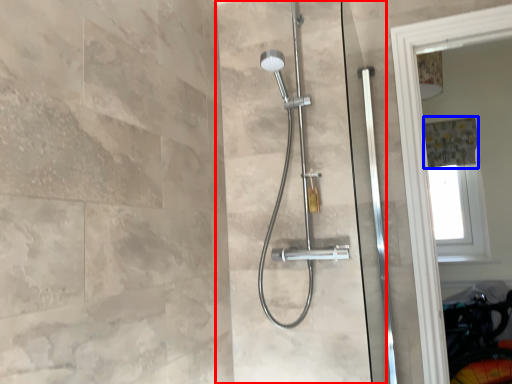
Question: Which point is closer to the camera, screen door (highlighted by a red box) or shower curtain (highlighted by a blue box)?

Choices:
 (A) screen door
 (B) shower curtain

Answer: (A)